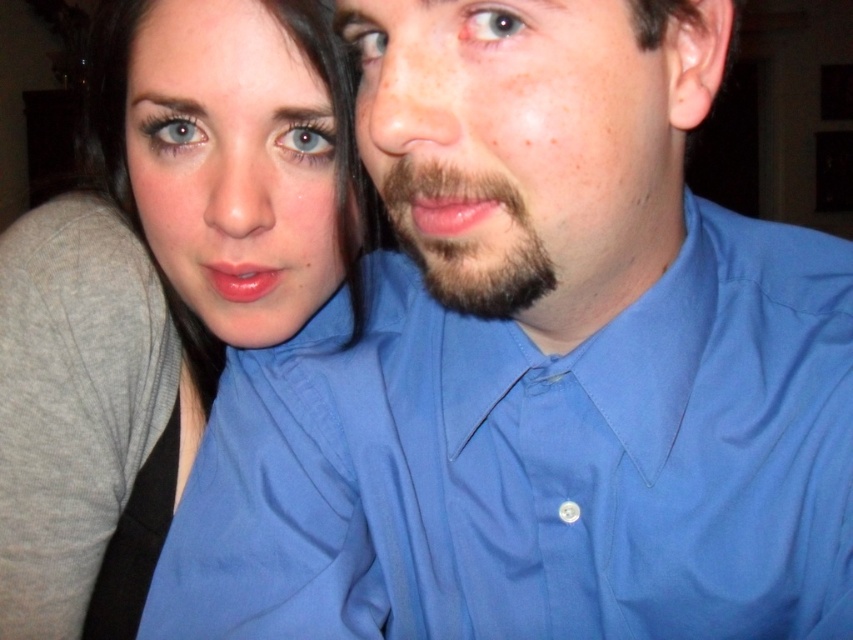
How much distance is there between blue smooth shirt at center and matte blue shirt at center?

blue smooth shirt at center is 7.72 inches from matte blue shirt at center.

This screenshot has width=853, height=640. What do you see at coordinates (537, 465) in the screenshot?
I see `blue smooth shirt at center` at bounding box center [537, 465].

At what (x,y) coordinates should I click in order to perform the action: click on blue smooth shirt at center. Please return your answer as a coordinate pair (x, y). Looking at the image, I should click on (537, 465).

At what (x,y) coordinates should I click in order to perform the action: click on blue smooth shirt at center. Please return your answer as a coordinate pair (x, y). The width and height of the screenshot is (853, 640). Looking at the image, I should click on (537, 465).

From the picture: Does blue smooth shirt at center lie behind dark brown fuzzy beard at center?

Yes, blue smooth shirt at center is further from the viewer.

Is point (312, 420) closer to camera compared to point (457, 241)?

That is False.

Is point (820, 444) farther from camera compared to point (399, 214)?

Yes, it is.

Locate an element on the screen. This screenshot has height=640, width=853. blue smooth shirt at center is located at coordinates (537, 465).

Between point (350, 225) and point (529, 288), which one is positioned behind?

The point (350, 225) is more distant.

Who is lower down, matte blue shirt at center or dark brown fuzzy beard at center?

matte blue shirt at center is below.

The width and height of the screenshot is (853, 640). What do you see at coordinates (160, 285) in the screenshot? I see `matte blue shirt at center` at bounding box center [160, 285].

Where is `matte blue shirt at center`? This screenshot has height=640, width=853. matte blue shirt at center is located at coordinates (160, 285).